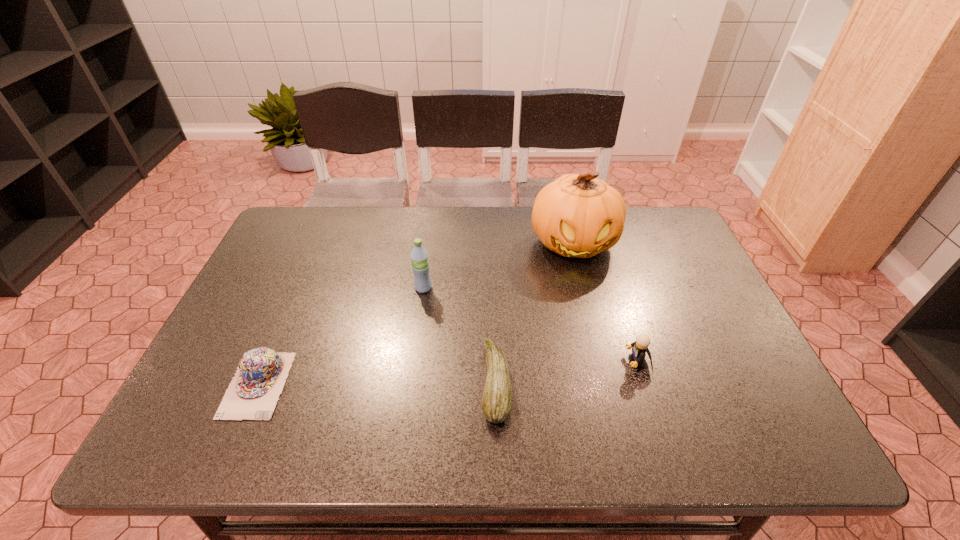
This screenshot has height=540, width=960. Identify the location of free space at the far edge. (493, 213).

In the image, there is a desktop. Identify the location of vacant space at the near edge. The image size is (960, 540). (527, 444).

You are a GUI agent. You are given a task and a screenshot of the screen. Output one action in this format:
    pyautogui.click(x=<x>, y=<y>)
    Task: Click on the vacant space at the left edge
    The image size is (960, 540).
    Given the screenshot: What is the action you would take?
    [x=228, y=327]

I want to click on blank space at the right edge of the desktop, so click(763, 392).

Find the location of a particular element. The height and width of the screenshot is (540, 960). blank space at the far left corner is located at coordinates (291, 214).

This screenshot has width=960, height=540. In the image, there is a desktop. Find the location of `vacant space at the near left corner`. vacant space at the near left corner is located at coordinates (217, 442).

Locate an element on the screen. The height and width of the screenshot is (540, 960). vacant space at the far right corner of the desktop is located at coordinates (661, 247).

Image resolution: width=960 pixels, height=540 pixels. I want to click on vacant area that lies between the third tallest object and the zucchini, so click(566, 373).

Locate an element on the screen. free area in between the pumpkin and the fourth object from right to left is located at coordinates click(x=498, y=265).

In order to click on free space between the water bottle and the Lego in this screenshot , I will do `click(530, 325)`.